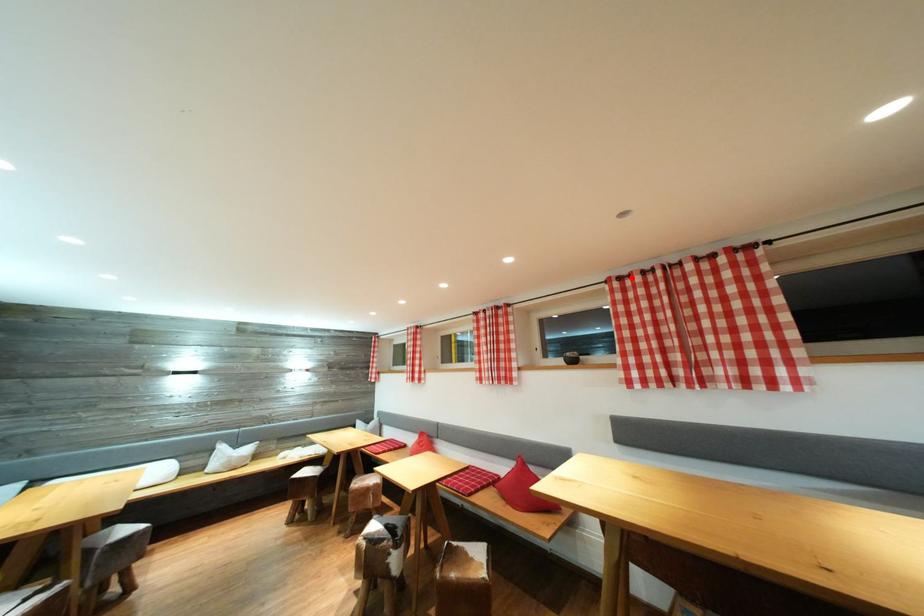
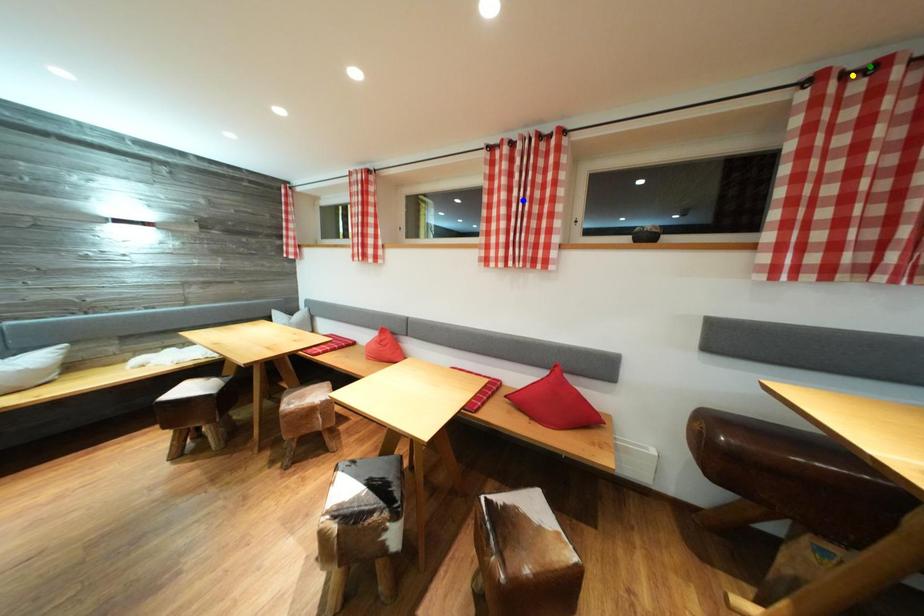
Question: I am providing you with two images of the same scene from different viewpoints. A red point is marked on the first image. You are given multiple points on the second image. Which point in image 2 is actually the same real-world point as the red point in image 1?

Choices:
 (A) blue point
 (B) yellow point
 (C) green point

Answer: (C)